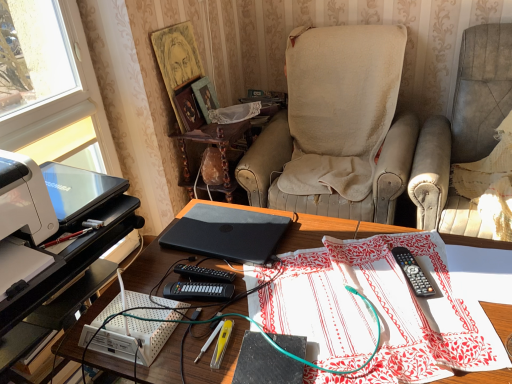
This screenshot has width=512, height=384. Identify the location of empty space that is ontop of matte black laptop at center (from a real-world perspective). (317, 289).